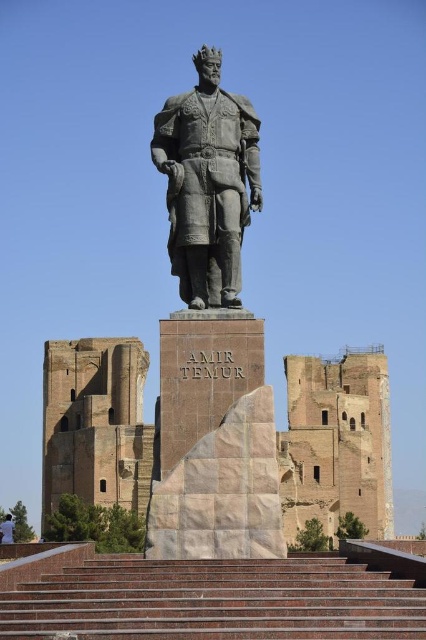
Based on the photo, is brown stone stairs at center shorter than bronze statue at center?

Yes, brown stone stairs at center is shorter than bronze statue at center.

This screenshot has height=640, width=426. What do you see at coordinates (215, 600) in the screenshot?
I see `brown stone stairs at center` at bounding box center [215, 600].

The height and width of the screenshot is (640, 426). Identify the location of brown stone stairs at center. (215, 600).

Does bronze statue at center have a greater height compared to white cotton shirt at lower left?

In fact, bronze statue at center may be shorter than white cotton shirt at lower left.

Does bronze statue at center lie in front of white cotton shirt at lower left?

Yes, bronze statue at center is closer to the viewer.

Is point (172, 140) in front of point (3, 525)?

Yes, it is in front of point (3, 525).

Find the location of `bronze statue at center`. bronze statue at center is located at coordinates (207, 182).

Who is positioned more to the left, brown stone stairs at center or white cotton shirt at lower left?

From the viewer's perspective, white cotton shirt at lower left appears more on the left side.

Which of these two, brown stone stairs at center or white cotton shirt at lower left, stands shorter?

brown stone stairs at center

Is point (400, 616) positioned after point (8, 515)?

No, it is not.

Identify the location of brown stone stairs at center. The height and width of the screenshot is (640, 426). (215, 600).